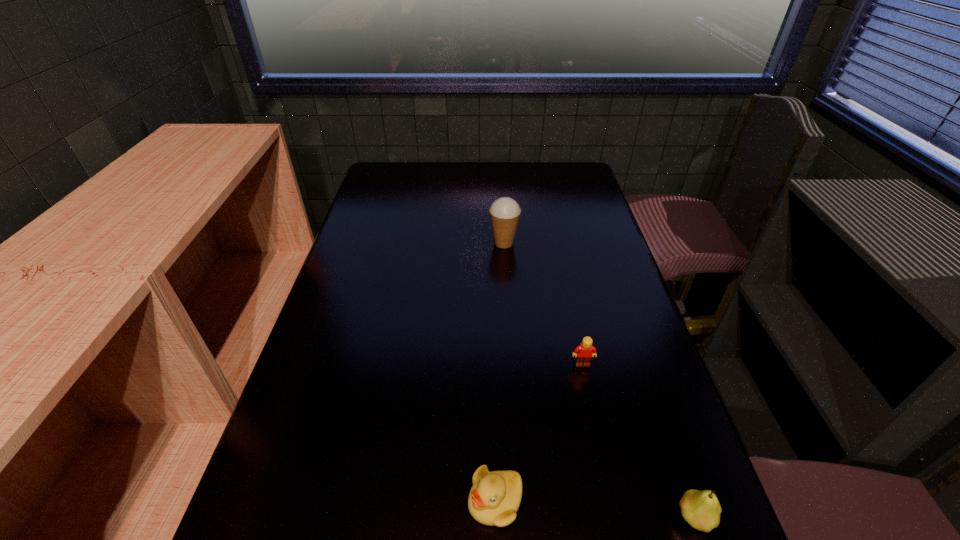
This screenshot has width=960, height=540. What are the coordinates of `vacant area in the image that satisfies the following two spatial constraints: 1. on the face of the Lego; 2. on the beak of the duckling` in the screenshot? It's located at (612, 501).

At what (x,y) coordinates should I click in order to perform the action: click on vacant space that satisfies the following two spatial constraints: 1. on the face of the second tallest object; 2. on the right side of the second object from right to left. Please return your answer as a coordinate pair (x, y). The height and width of the screenshot is (540, 960). Looking at the image, I should click on (615, 518).

Locate an element on the screen. This screenshot has height=540, width=960. free space that satisfies the following two spatial constraints: 1. on the face of the Lego; 2. on the left side of the pear is located at coordinates (615, 518).

The image size is (960, 540). What are the coordinates of `vacant region that satisfies the following two spatial constraints: 1. on the beak of the rightmost object; 2. on the left side of the duckling` in the screenshot? It's located at (495, 518).